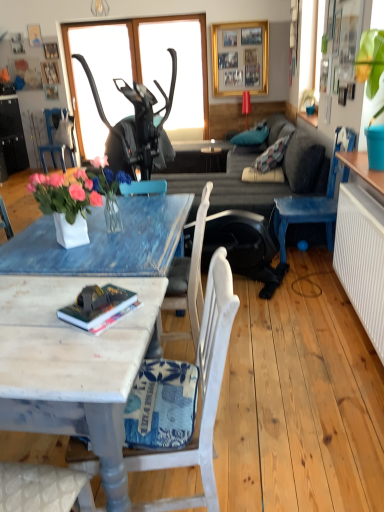
The width and height of the screenshot is (384, 512). In order to click on free space above hardcover book at center (from a real-world perspective) in this screenshot , I will do `click(107, 304)`.